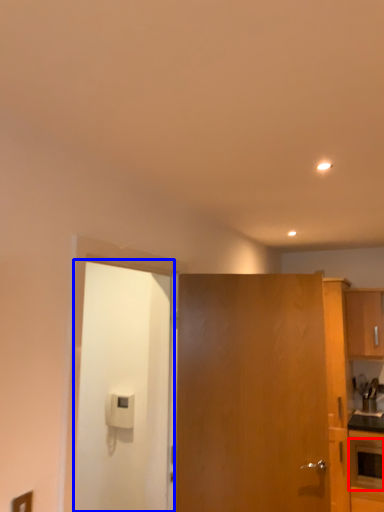
Question: Which point is closer to the camera, appliance (highlighted by a red box) or door (highlighted by a blue box)?

Choices:
 (A) appliance
 (B) door

Answer: (B)